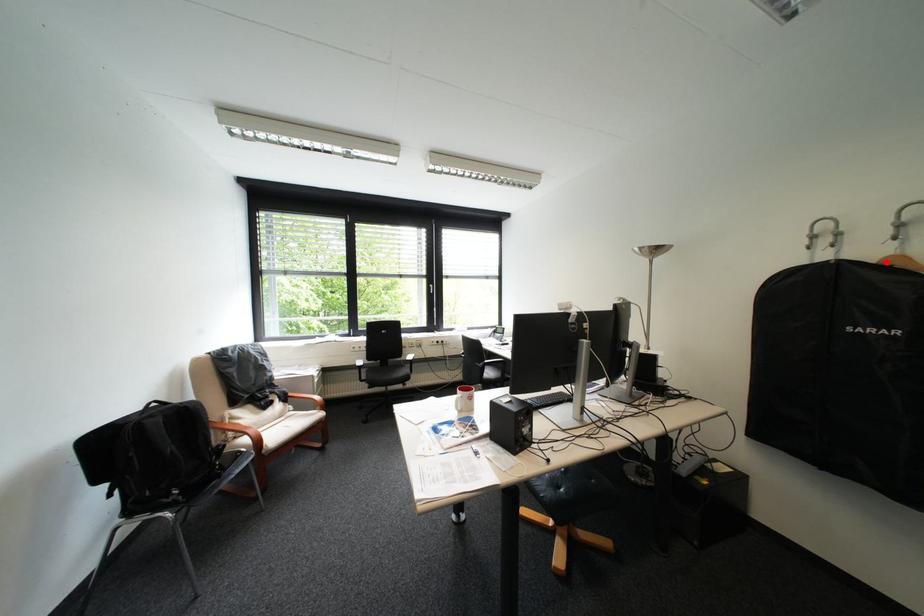
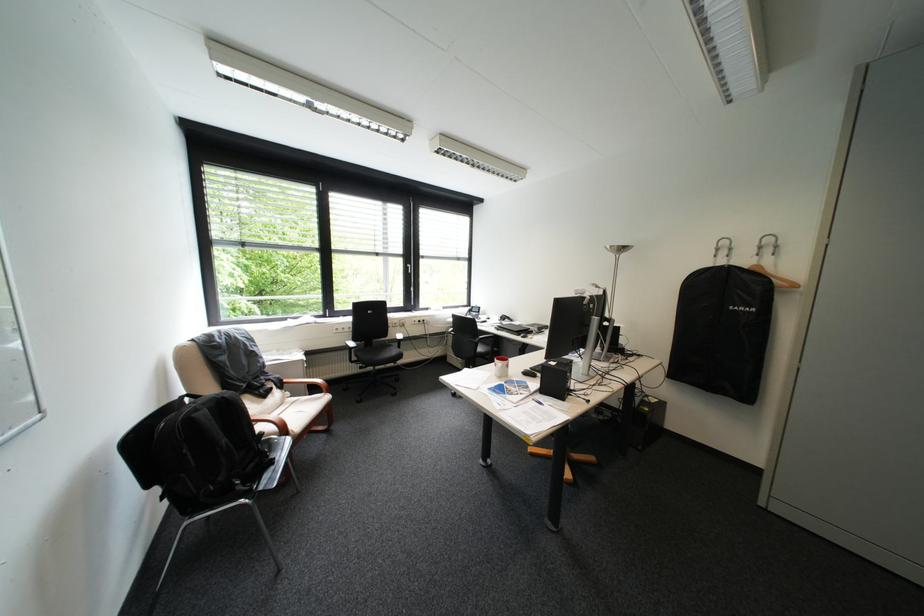
The point at the highlighted location is marked in the first image. Where is the corresponding point in the second image?

(759, 268)